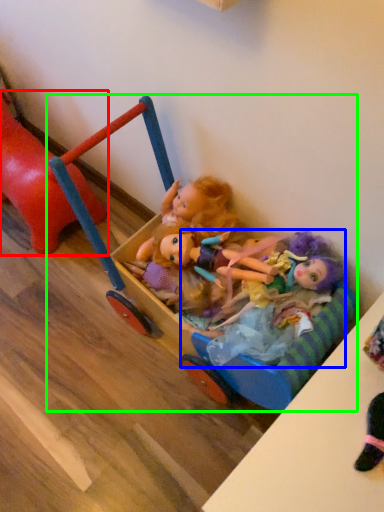
Question: Based on their relative distances, which object is farther from toy (highlighted by a red box)? Choose from doll (highlighted by a blue box) and toy (highlighted by a green box).

Choices:
 (A) doll
 (B) toy

Answer: (A)